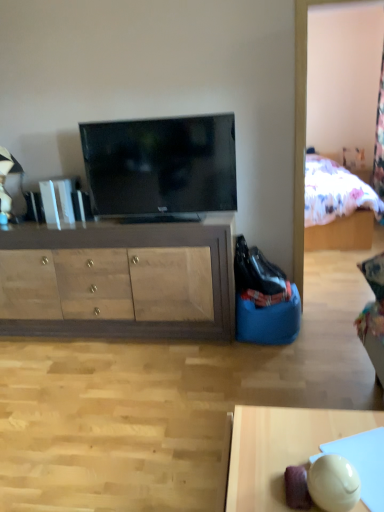
Question: Is wooden cabinet at center at the left side of smooth wooden desk at lower right?

Choices:
 (A) yes
 (B) no

Answer: (A)

Question: From the image's perspective, does wooden cabinet at center appear higher than smooth wooden desk at lower right?

Choices:
 (A) yes
 (B) no

Answer: (A)

Question: Does wooden cabinet at center have a larger size compared to smooth wooden desk at lower right?

Choices:
 (A) yes
 (B) no

Answer: (A)

Question: Is wooden cabinet at center located outside smooth wooden desk at lower right?

Choices:
 (A) no
 (B) yes

Answer: (B)

Question: Is wooden cabinet at center positioned in front of smooth wooden desk at lower right?

Choices:
 (A) no
 (B) yes

Answer: (A)

Question: Is matte black tv at center in front of or behind smooth wooden desk at lower right in the image?

Choices:
 (A) front
 (B) behind

Answer: (B)

Question: Which is correct: matte black tv at center is inside smooth wooden desk at lower right, or outside of it?

Choices:
 (A) outside
 (B) inside

Answer: (A)

Question: Is matte black tv at center wider or thinner than smooth wooden desk at lower right?

Choices:
 (A) thin
 (B) wide

Answer: (A)

Question: Based on their sizes in the image, would you say matte black tv at center is bigger or smaller than smooth wooden desk at lower right?

Choices:
 (A) small
 (B) big

Answer: (A)

Question: From a real-world perspective, is matte black tv at center above or below wooden cabinet at center?

Choices:
 (A) below
 (B) above

Answer: (B)

Question: From the image's perspective, relative to wooden cabinet at center, is matte black tv at center above or below?

Choices:
 (A) below
 (B) above

Answer: (B)

Question: Relative to wooden cabinet at center, is matte black tv at center in front or behind?

Choices:
 (A) behind
 (B) front

Answer: (B)

Question: From their relative heights in the image, would you say matte black tv at center is taller or shorter than wooden cabinet at center?

Choices:
 (A) tall
 (B) short

Answer: (B)

Question: Is wooden cabinet at center wider or thinner than smooth wooden desk at lower right?

Choices:
 (A) thin
 (B) wide

Answer: (B)

Question: In the image, is wooden cabinet at center on the left side or the right side of smooth wooden desk at lower right?

Choices:
 (A) right
 (B) left

Answer: (B)